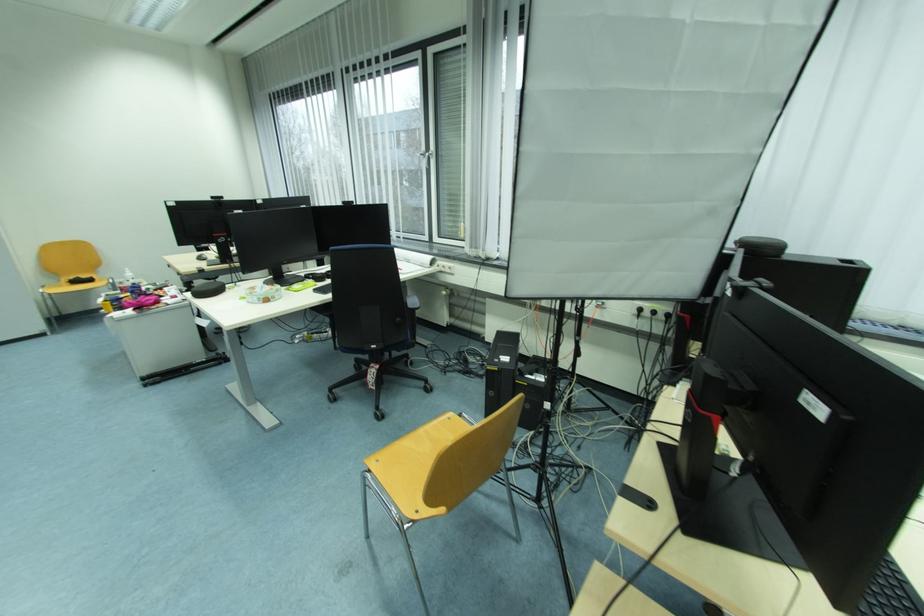
Where would you push the power strip switch? Please return your answer as a coordinate pair (x, y).

(647, 309)